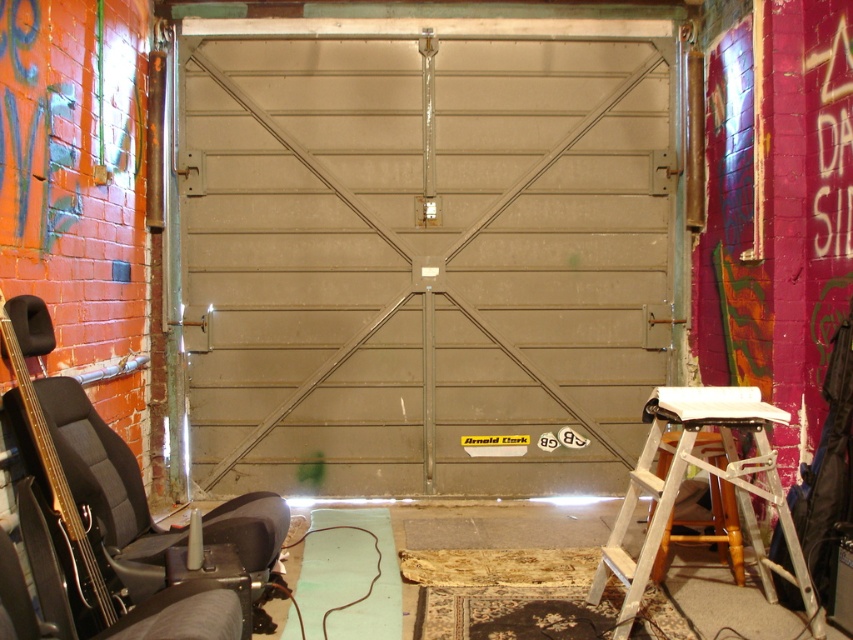
Question: Which point appears closest to the camera in this image?

Choices:
 (A) (650, 436)
 (B) (648, 195)

Answer: (A)

Question: Is metallic gray garage door at center above white metallic ladder at lower right?

Choices:
 (A) no
 (B) yes

Answer: (B)

Question: Is metallic gray garage door at center smaller than black leather chair at lower left?

Choices:
 (A) yes
 (B) no

Answer: (B)

Question: Which of the following is the closest to the observer?

Choices:
 (A) metallic gray garage door at center
 (B) black leather chair at lower left

Answer: (B)

Question: Which of the following is the farthest from the observer?

Choices:
 (A) (556, 317)
 (B) (651, 483)
 (C) (126, 515)

Answer: (A)

Question: Is metallic gray garage door at center further to camera compared to white metallic ladder at lower right?

Choices:
 (A) yes
 (B) no

Answer: (A)